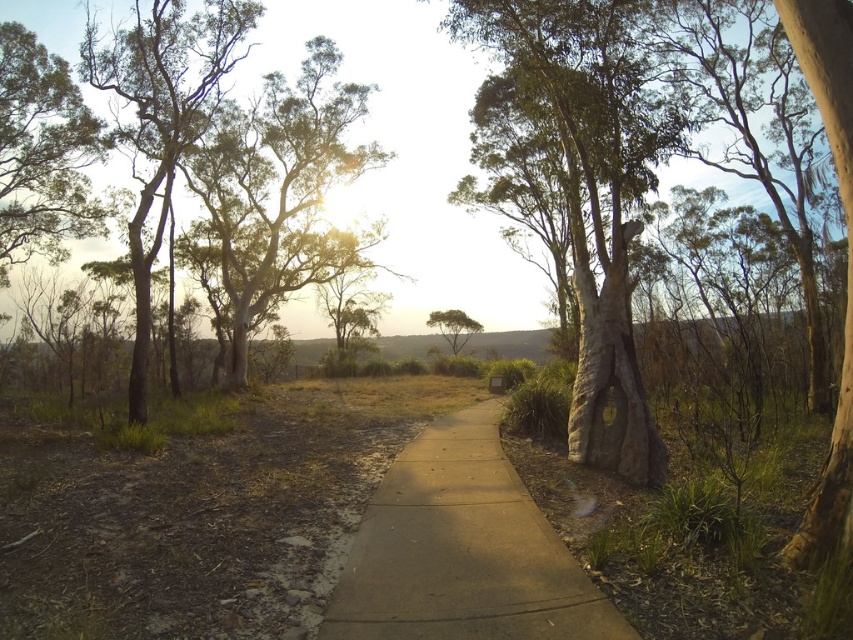
Question: Which object is closer to the camera taking this photo?

Choices:
 (A) green leafy tree at upper left
 (B) green rough bark tree at upper left

Answer: (B)

Question: From the image, what is the correct spatial relationship of green rough bark tree at upper left in relation to smooth bark tree at left?

Choices:
 (A) above
 (B) below

Answer: (B)

Question: Which object is positioned farthest from the green rough bark tree at center?

Choices:
 (A) green leafy tree at upper left
 (B) concrete at center

Answer: (B)

Question: Does smooth bark tree at left have a greater width compared to brown rough bark tree at right?

Choices:
 (A) yes
 (B) no

Answer: (A)

Question: Does smooth bark tree at left appear on the left side of green rough bark tree at center?

Choices:
 (A) yes
 (B) no

Answer: (A)

Question: Which of these objects is positioned farthest from the green rough bark tree at upper left?

Choices:
 (A) smooth bark tree at left
 (B) brown rough bark tree at right
 (C) concrete at center
 (D) green leafy tree at upper left

Answer: (B)